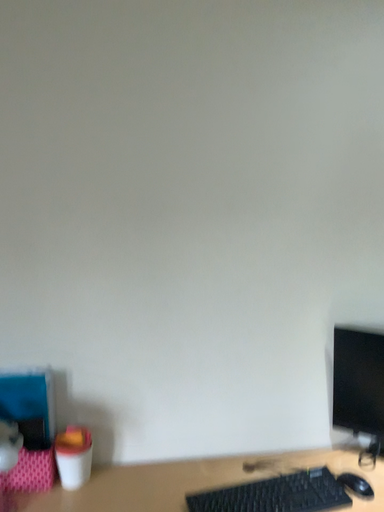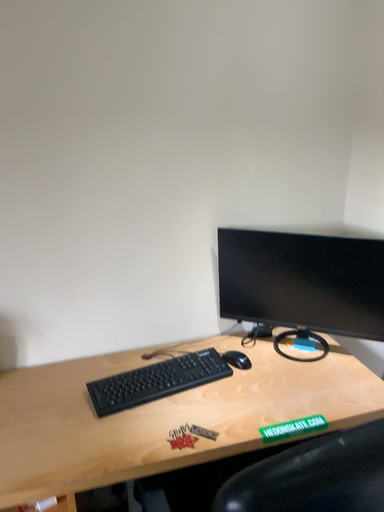
Question: Which way did the camera rotate in the video?

Choices:
 (A) rotated right
 (B) rotated left

Answer: (A)